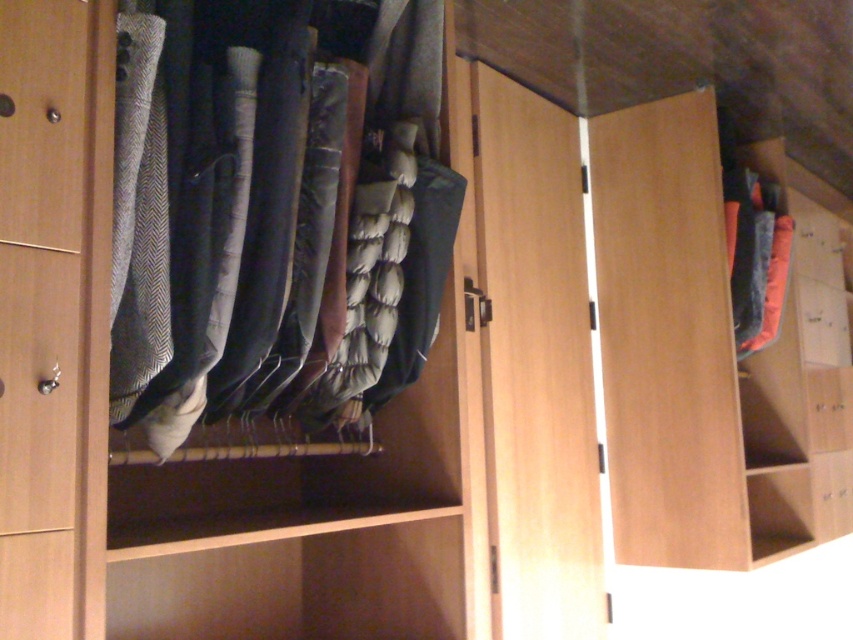
Question: Can you confirm if dark gray wool pants at center is smaller than orange fuzzy socks at right?

Choices:
 (A) yes
 (B) no

Answer: (B)

Question: Can you confirm if dark gray wool pants at center is bigger than wooden drawer at center?

Choices:
 (A) no
 (B) yes

Answer: (B)

Question: Which object appears farthest from the camera in this image?

Choices:
 (A) orange fuzzy socks at right
 (B) wooden drawer at lower right
 (C) dark gray wool pants at center
 (D) wooden shelf at right

Answer: (B)

Question: Estimate the real-world distances between objects in this image. Which object is farther from the orange fuzzy socks at right?

Choices:
 (A) wooden drawer at center
 (B) wooden drawer at lower right

Answer: (B)

Question: Which object is farther from the camera taking this photo?

Choices:
 (A) wooden shelf at right
 (B) dark gray wool pants at center
 (C) wooden drawer at lower right
 (D) wooden drawer at center

Answer: (D)

Question: Can you confirm if wooden shelf at right is smaller than dark gray wool pants at center?

Choices:
 (A) no
 (B) yes

Answer: (A)